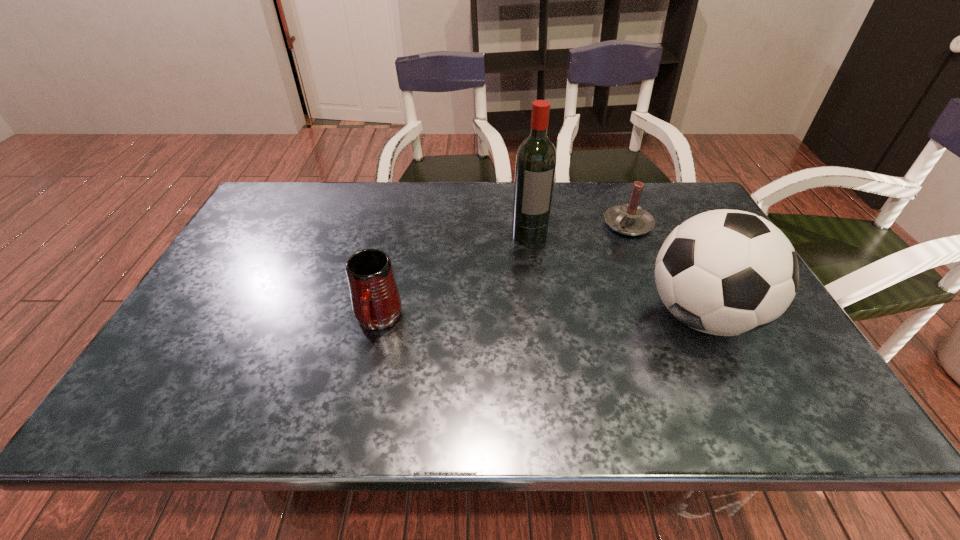
Where is `free space on the desktop that is between the leftmost object and the second tallest object and is positioned on the side of the candle with the handle loop`? free space on the desktop that is between the leftmost object and the second tallest object and is positioned on the side of the candle with the handle loop is located at coordinates [526, 318].

Image resolution: width=960 pixels, height=540 pixels. I want to click on free space on the desktop that is between the mug and the soccer ball and is positioned on the label of the wine bottle, so click(x=558, y=318).